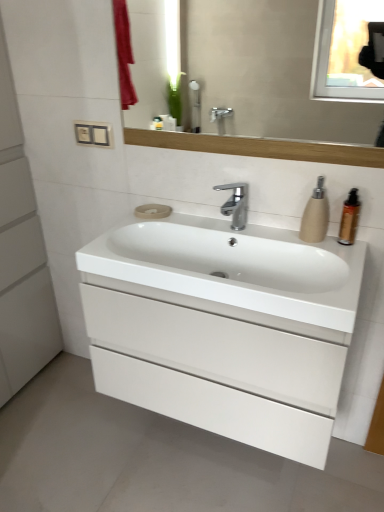
Question: Do you think beige matte soap at center is within white matte cabinet at left, or outside of it?

Choices:
 (A) inside
 (B) outside

Answer: (B)

Question: Considering their positions, is beige matte soap at center located in front of or behind white matte cabinet at left?

Choices:
 (A) front
 (B) behind

Answer: (B)

Question: Which object is the farthest from the matte wooden mirror at upper center?

Choices:
 (A) white glossy cabinet at center
 (B) matte beige soap dispenser at right
 (C) beige matte soap at center
 (D) white glossy sink at center
 (E) brown glossy bottle at right

Answer: (E)

Question: Which object is positioned closest to the beige matte soap at center?

Choices:
 (A) brown glossy bottle at right
 (B) white matte cabinet at left
 (C) matte wooden mirror at upper center
 (D) white glossy sink at center
 (E) polished chrome faucet at center

Answer: (E)